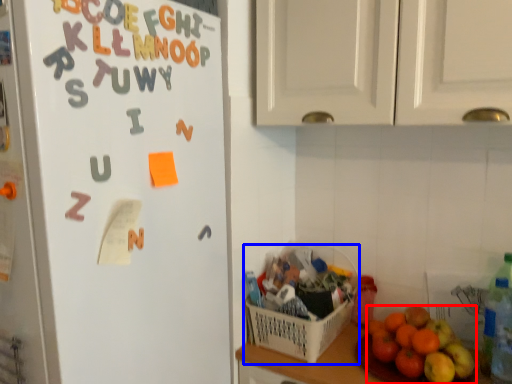
Question: Which object is closer to the camera taking this photo, grapefruit (highlighted by a red box) or basket (highlighted by a blue box)?

Choices:
 (A) grapefruit
 (B) basket

Answer: (A)